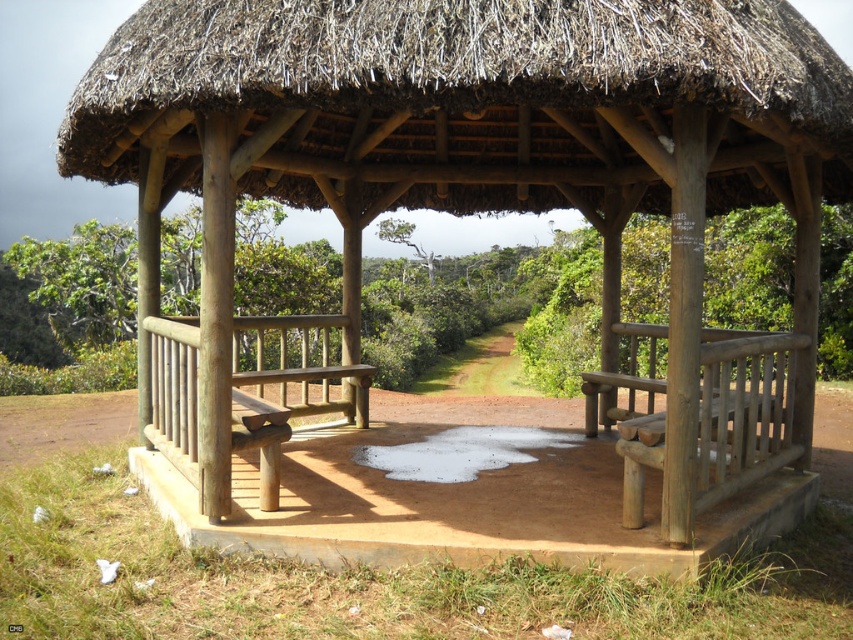
You are a maintenance worker needing to inspect the thatched straw roof at center from the natural wood bench at right. Given that your inspection tool has a maximum reach of 3 meters, can you effectively reach the roof from the bench without moving?

The distance between the thatched straw roof at center and the natural wood bench at right is 3.72 meters, which exceeds the 3 meter reach of your tool. You cannot effectively reach the roof from the bench without moving closer.

You are planning to install a new lighting fixture that requires a minimum clearance of 2 meters. Based on the scene, can the thatched straw roof at center and the natural wood bench at right accommodate this requirement?

The thatched straw roof at center is shorter than the natural wood bench at right. Since the roof is shorter, it might not provide the required 2 meters of clearance. Check the height of the natural wood bench at right to determine if it meets the clearance requirement.